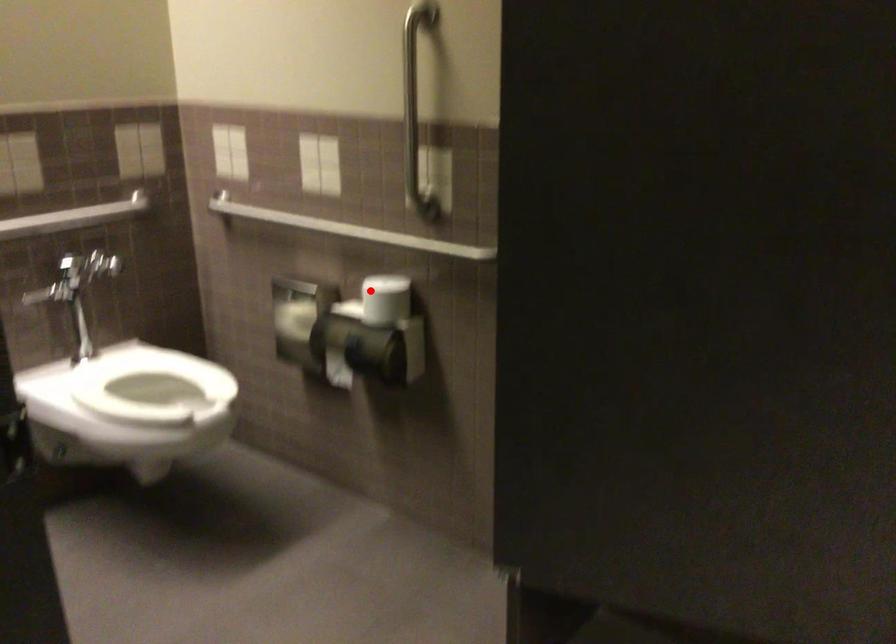
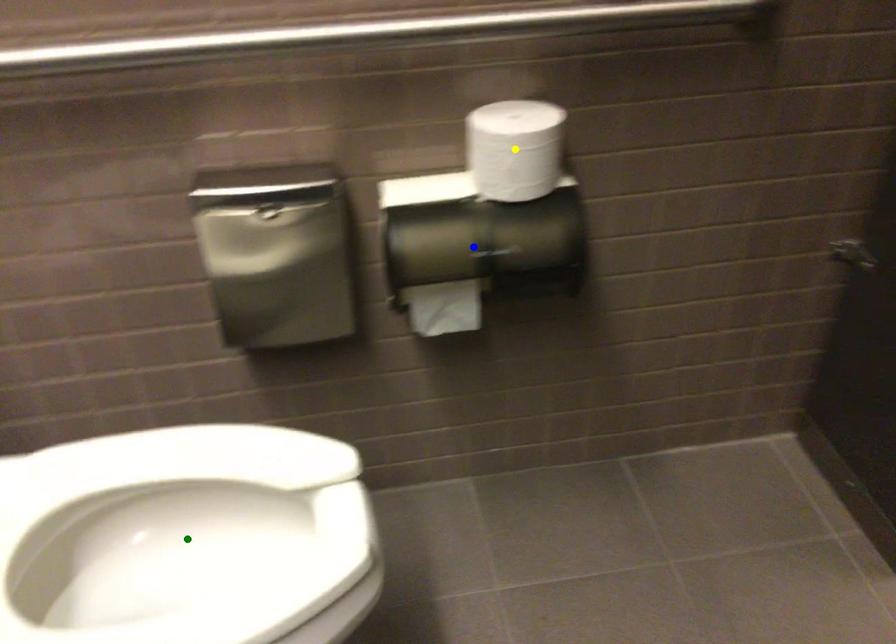
Question: I am providing you with two images of the same scene from different viewpoints. A red point is marked on the first image. You are given multiple points on the second image. In image 2, which mark is for the same physical point as the one in image 1?

Choices:
 (A) blue point
 (B) yellow point
 (C) green point

Answer: (B)